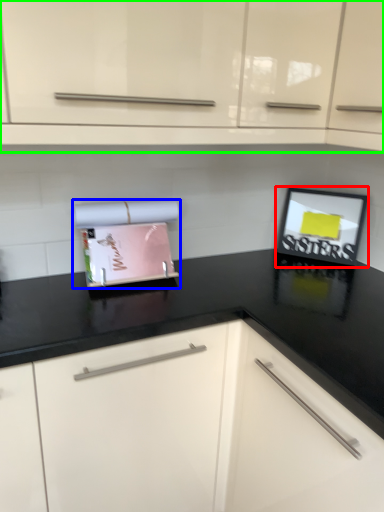
Question: Considering the real-world distances, which object is farthest from picture frame (highlighted by a red box)? appliance (highlighted by a blue box) or cabinetry (highlighted by a green box)?

Choices:
 (A) appliance
 (B) cabinetry

Answer: (B)